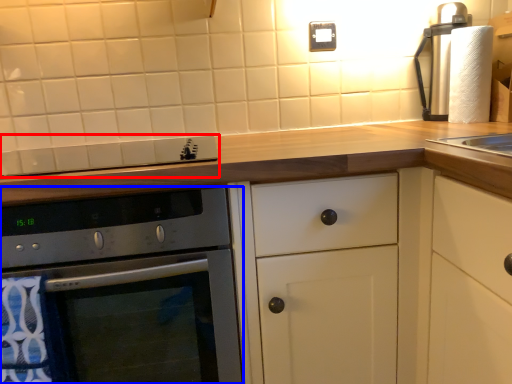
Question: Which of the following is the farthest to the observer, gas stove (highlighted by a red box) or oven (highlighted by a blue box)?

Choices:
 (A) gas stove
 (B) oven

Answer: (A)